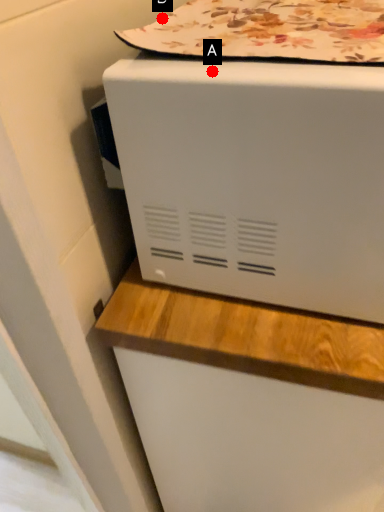
Question: Two points are circled on the image, labeled by A and B beside each circle. Which point is farther to the camera?

Choices:
 (A) A is further
 (B) B is further

Answer: (B)